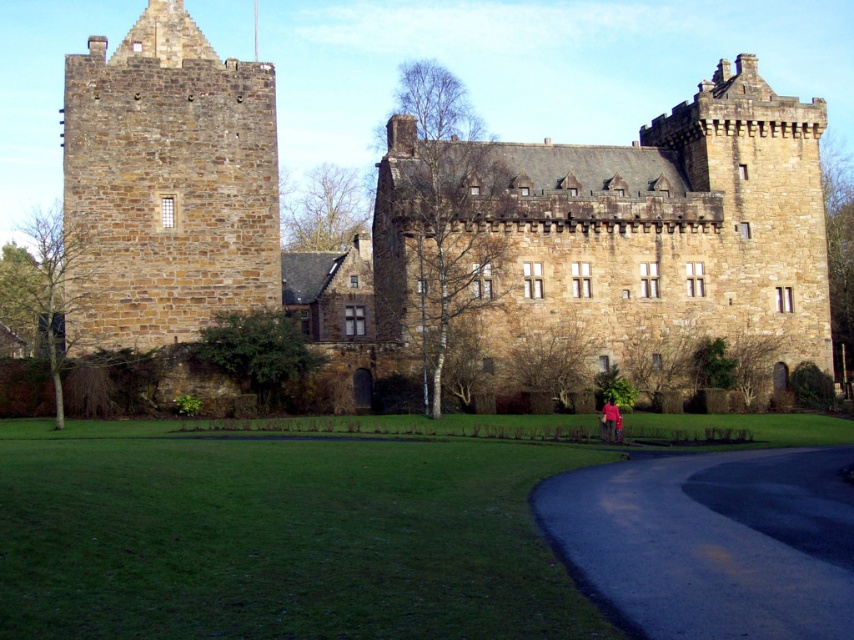
Does point (170, 42) come behind point (841, 502)?

Yes.

Is brown stone tower at left below dark asphalt road at lower right?

No.

Does point (170, 112) come behind point (794, 460)?

Yes, it is.

The image size is (854, 640). What are the coordinates of `brown stone tower at left` in the screenshot? It's located at coord(167,186).

Is brown stone castle at upper center taller than pink fabric at lower center?

Yes, brown stone castle at upper center is taller than pink fabric at lower center.

In the scene shown: Can you confirm if brown stone castle at upper center is positioned to the left of pink fabric at lower center?

Indeed, brown stone castle at upper center is positioned on the left side of pink fabric at lower center.

Identify the location of brown stone castle at upper center. This screenshot has height=640, width=854. (616, 230).

From the picture: How distant is brown stone castle at upper center from dark asphalt road at lower right?

brown stone castle at upper center and dark asphalt road at lower right are 32.90 meters apart.

Does brown stone castle at upper center appear on the left side of dark asphalt road at lower right?

Correct, you'll find brown stone castle at upper center to the left of dark asphalt road at lower right.

Who is more distant from viewer, (723, 276) or (844, 481)?

Positioned behind is point (723, 276).

You are a GUI agent. You are given a task and a screenshot of the screen. Output one action in this format:
    pyautogui.click(x=<x>, y=<y>)
    Task: Click on the brown stone castle at upper center
    The width and height of the screenshot is (854, 640).
    Given the screenshot: What is the action you would take?
    pyautogui.click(x=616, y=230)